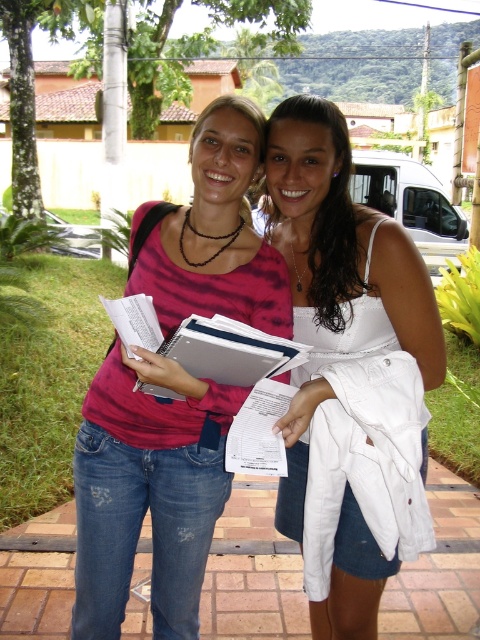
You are a photographer standing 10 feet away from the two people in the image. You want to take a photo that includes both the pink matte shirt at center and the white satin tank top at center without any part of them being cut off. Given that your camera has a maximum focus range of 10 feet, will you be able to capture both subjects clearly in the same frame?

The pink matte shirt at center is 20.08 inches away from the white satin tank top at center. Since both are within the 10 feet distance from you, your camera can focus on both, so yes, you can capture both clearly in the same frame.

You are taking a photo of two people in the courtyard. The first person is at point (245, 317) and the second is at point (278, 116). To ensure both are in focus, which point should you focus on?

You should focus on point (278, 116) because it is farther from the camera than point (245, 317), ensuring both are within the depth of field.